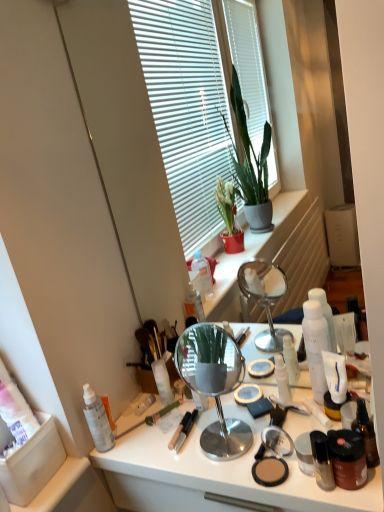
You are a GUI agent. You are given a task and a screenshot of the screen. Output one action in this format:
    pyautogui.click(x=<x>, y=<y>)
    Task: Click on the free space behind matte brown compact at lower center
    
    Given the screenshot: What is the action you would take?
    [253, 423]